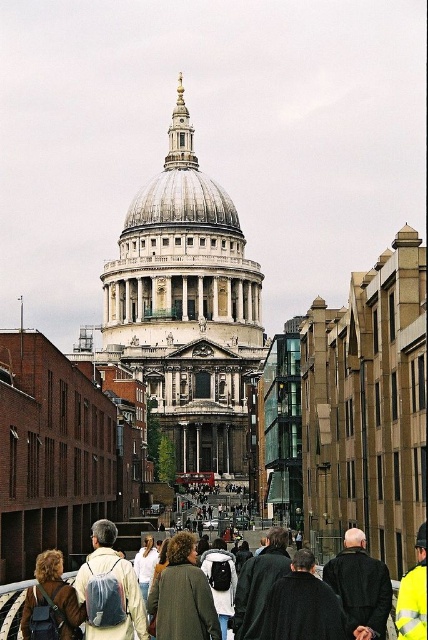
Based on the scene description, where is the white marble cathedral at center located in the image?

The white marble cathedral at center is located at point 2D coordinates of (187, 308).

You are standing in the urban scene with St. Paul Cathedral. There is a point at coordinates point (x=216, y=237). Can you walk to that point from where you are standing?

The point at coordinates point (x=216, y=237) is 130.76 meters away from you. Since it is a straight path, you can walk to that point from where you are standing.